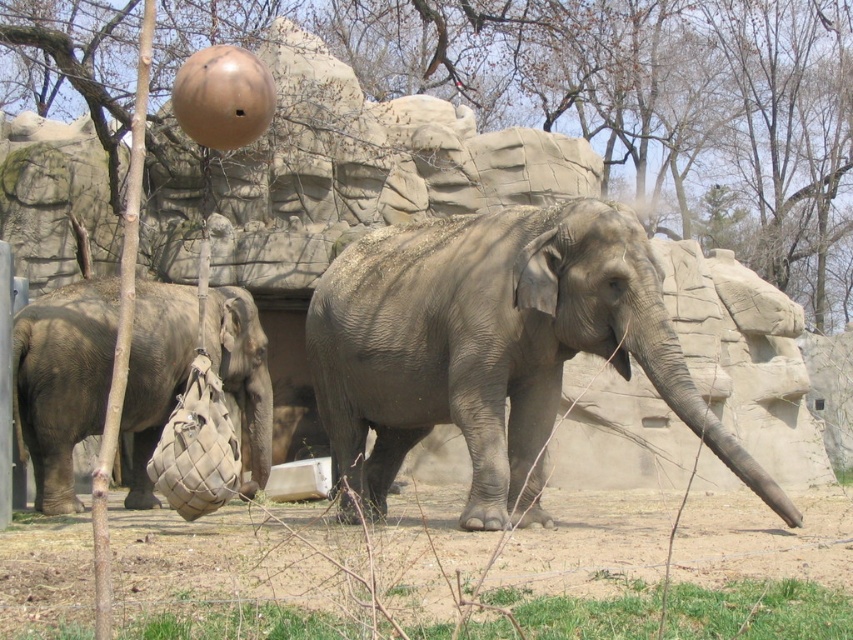
Question: Which point is closer to the camera?

Choices:
 (A) (96, 300)
 (B) (378, 435)

Answer: (B)

Question: Is the position of gray matte elephant at center less distant than that of gray matte bag at left?

Choices:
 (A) yes
 (B) no

Answer: (A)

Question: Does gray matte elephant at center have a smaller size compared to gray matte bag at left?

Choices:
 (A) yes
 (B) no

Answer: (B)

Question: Can you confirm if gray matte elephant at center is positioned to the right of gray matte bag at left?

Choices:
 (A) no
 (B) yes

Answer: (B)

Question: Which point is closer to the camera?

Choices:
 (A) (144, 296)
 (B) (531, 342)

Answer: (B)